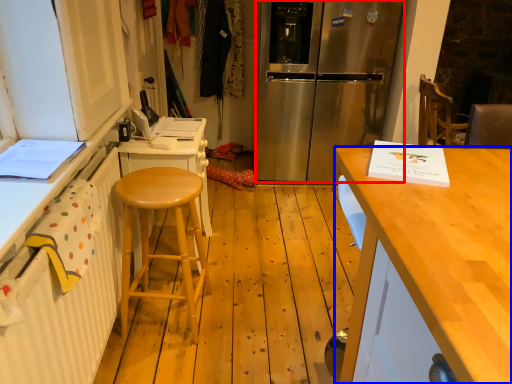
Question: Among these objects, which one is nearest to the camera, refrigerator (highlighted by a red box) or desk (highlighted by a blue box)?

Choices:
 (A) refrigerator
 (B) desk

Answer: (B)